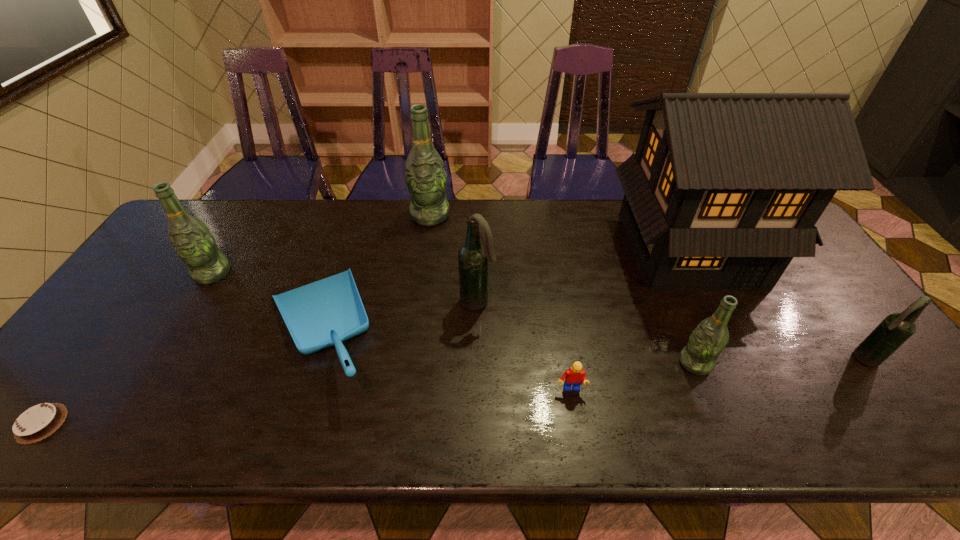
Where is `vacant region located 0.260m on the surface of the leftmost green beer bottle`? vacant region located 0.260m on the surface of the leftmost green beer bottle is located at coordinates (157, 364).

This screenshot has height=540, width=960. Find the location of `vacant space situated 0.100m on the left of the third farthest beer bottle`. vacant space situated 0.100m on the left of the third farthest beer bottle is located at coordinates 423,302.

At what (x,y) coordinates should I click in order to perform the action: click on vacant space located 0.150m on the front of the smaller dark beer bottle. Please return your answer as a coordinate pair (x, y). Looking at the image, I should click on (913, 428).

Image resolution: width=960 pixels, height=540 pixels. In order to click on vacant space located 0.140m on the surface of the smallest green beer bottle in this screenshot , I will do `click(621, 363)`.

Where is `blank space located on the surface of the smallest green beer bottle`? The image size is (960, 540). blank space located on the surface of the smallest green beer bottle is located at coordinates (659, 363).

This screenshot has width=960, height=540. I want to click on free spot located 0.070m on the surface of the smallest green beer bottle, so click(x=650, y=363).

Where is `vacant position located on the front of the seventh object from right to left`? vacant position located on the front of the seventh object from right to left is located at coordinates (282, 444).

The height and width of the screenshot is (540, 960). Identify the location of free region located on the right of the chocolate cake. (92, 423).

The image size is (960, 540). I want to click on dollhouse positioned at the far edge, so click(x=724, y=190).

Locate an element on the screen. Image resolution: width=960 pixels, height=540 pixels. beer bottle that is at the far edge is located at coordinates (425, 176).